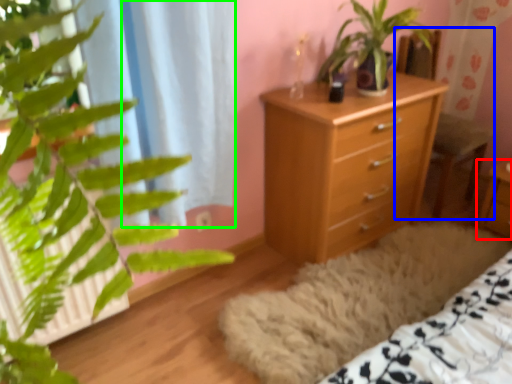
Question: Which object is the closest to the nightstand (highlighted by a red box)? Choose among these: armchair (highlighted by a blue box) or curtain (highlighted by a green box).

Choices:
 (A) armchair
 (B) curtain

Answer: (A)